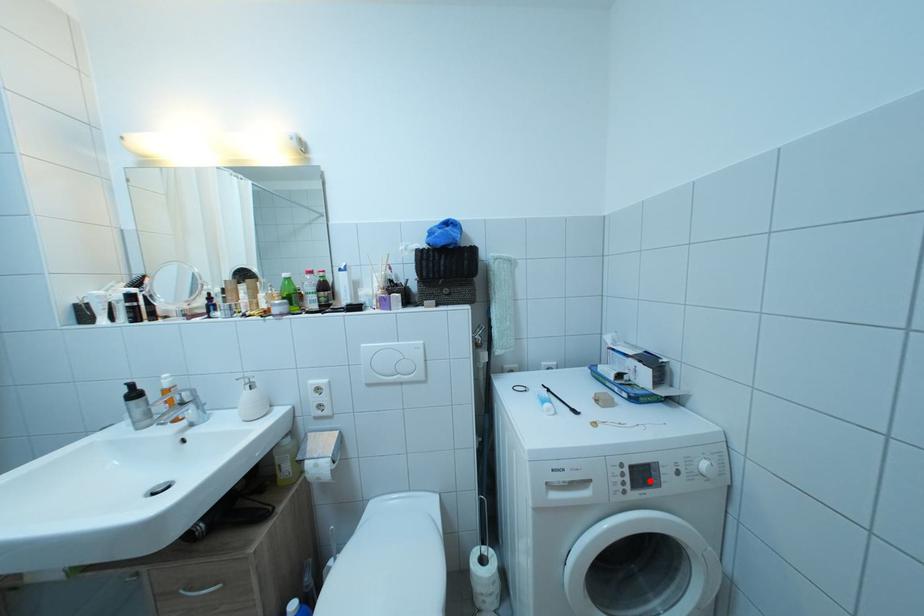
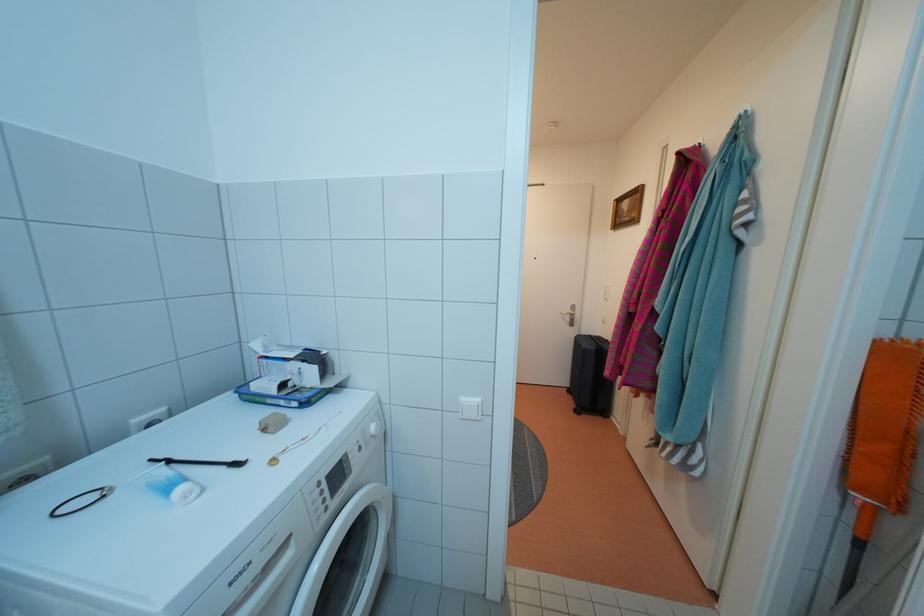
In the second image, find the point that corresponds to the highlighted location in the first image.

(345, 482)